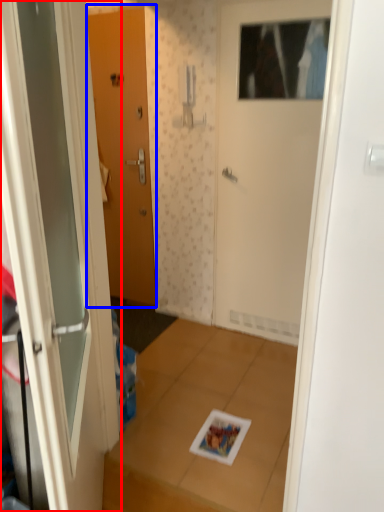
Question: Among these objects, which one is nearest to the camera, door (highlighted by a red box) or door (highlighted by a blue box)?

Choices:
 (A) door
 (B) door

Answer: (A)